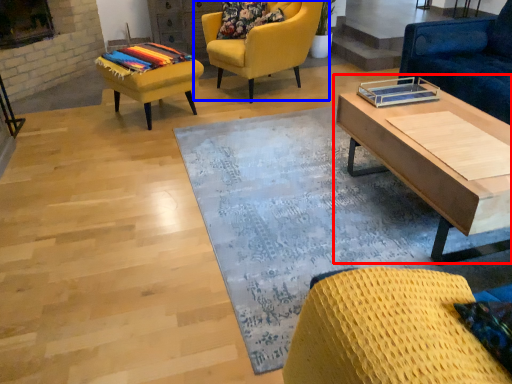
Question: Which of the following is the farthest to the observer, coffee table (highlighted by a red box) or chair (highlighted by a blue box)?

Choices:
 (A) coffee table
 (B) chair

Answer: (B)